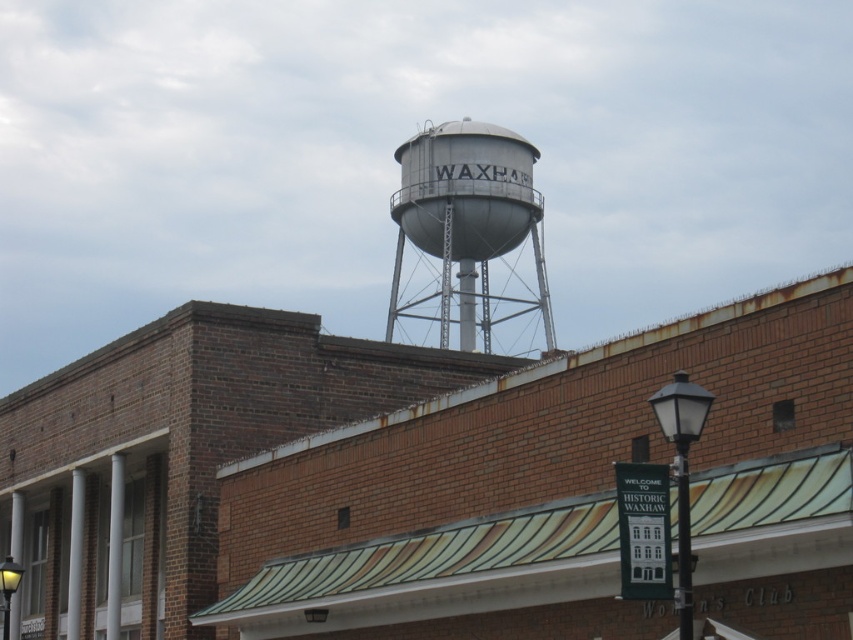
Who is taller, white metal water tower at upper center or silver metallic water tower at upper center?

silver metallic water tower at upper center is taller.

Is white metal water tower at upper center behind silver metallic water tower at upper center?

No.

Who is more forward, (x=181, y=531) or (x=432, y=301)?

Positioned in front is point (x=181, y=531).

You are a GUI agent. You are given a task and a screenshot of the screen. Output one action in this format:
    pyautogui.click(x=<x>, y=<y>)
    Task: Click on the white metal water tower at upper center
    This screenshot has height=640, width=853.
    Given the screenshot: What is the action you would take?
    point(425,481)